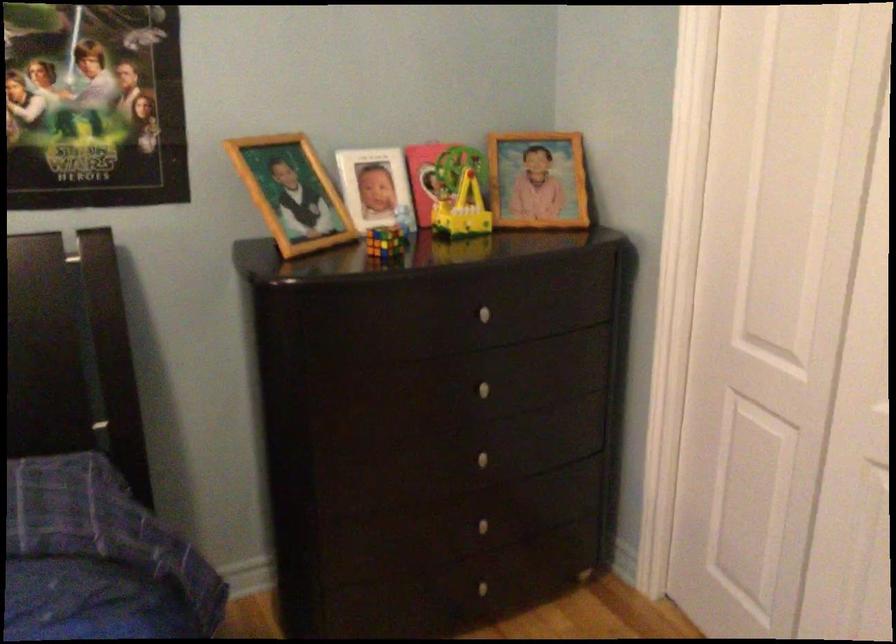
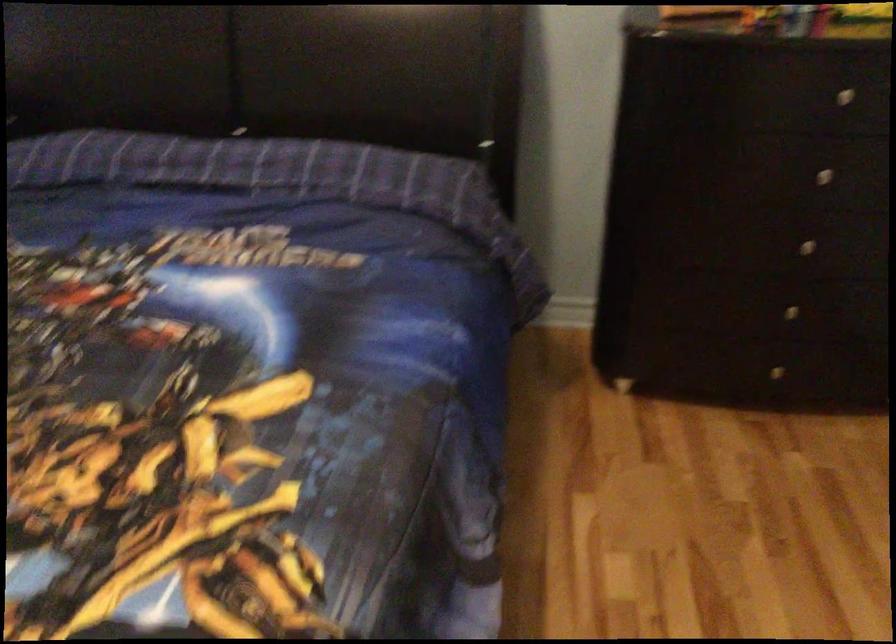
Question: The first image is from the beginning of the video and the second image is from the end. How did the camera likely rotate when shooting the video?

Choices:
 (A) Left
 (B) Right
 (C) Up
 (D) Down

Answer: (A)